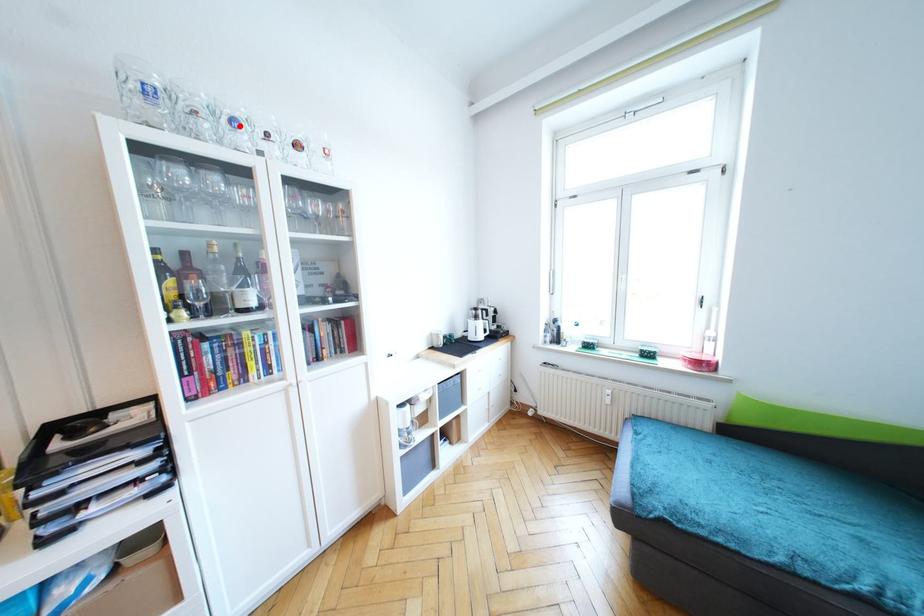
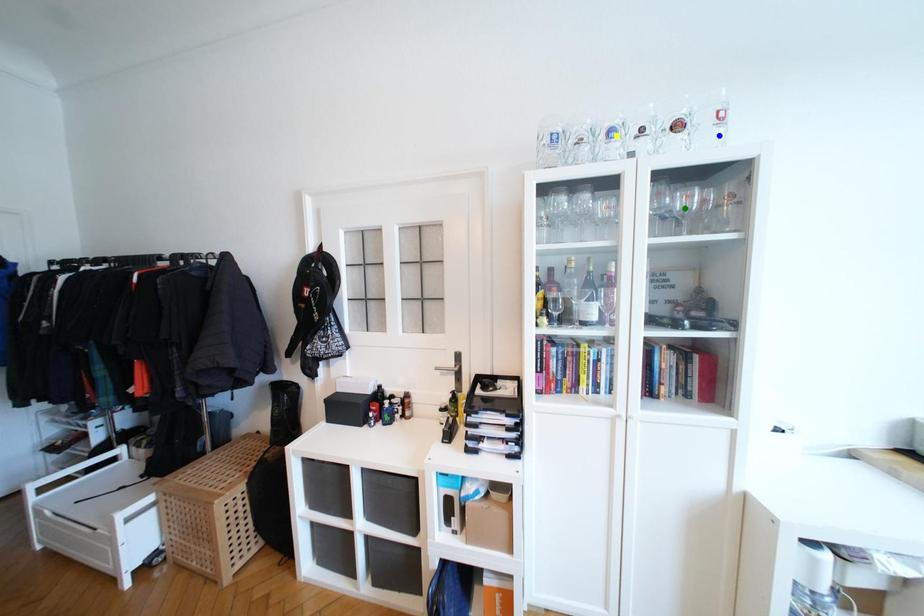
Question: I am providing you with two images of the same scene from different viewpoints. A red point is marked on the first image. You are given multiple points on the second image. Which mark in image 2 goes with the point in image 1?

Choices:
 (A) blue point
 (B) yellow point
 (C) green point

Answer: (B)